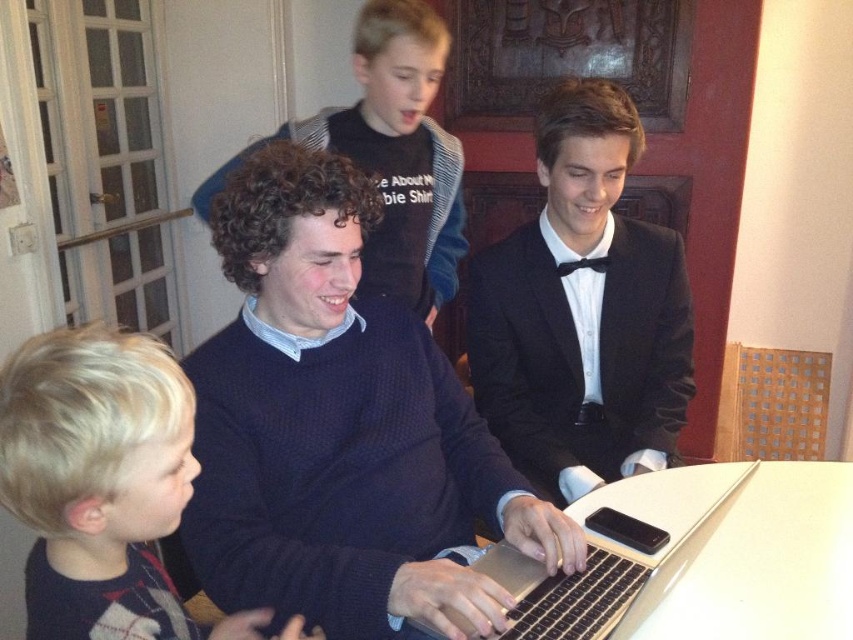
Between black satin tuxedo at center and silver metallic laptop at center, which one appears on the left side from the viewer's perspective?

silver metallic laptop at center is more to the left.

Who is taller, black satin tuxedo at center or silver metallic laptop at center?

With more height is black satin tuxedo at center.

Find the location of `black satin tuxedo at center`. black satin tuxedo at center is located at coordinates (582, 310).

Does black satin tuxedo at center have a lesser height compared to blonde hair at lower left?

Incorrect, black satin tuxedo at center's height does not fall short of blonde hair at lower left's.

Who is shorter, black satin tuxedo at center or blonde hair at lower left?

With less height is blonde hair at lower left.

Does point (653, 225) come farther from viewer compared to point (161, 582)?

Yes, it is behind point (161, 582).

Locate an element on the screen. black satin tuxedo at center is located at coordinates (582, 310).

Who is taller, dark blue sweater at center or blonde hair at lower left?

Standing taller between the two is dark blue sweater at center.

Can you confirm if dark blue sweater at center is positioned above blonde hair at lower left?

Indeed, dark blue sweater at center is positioned over blonde hair at lower left.

At what (x,y) coordinates should I click in order to perform the action: click on dark blue sweater at center. Please return your answer as a coordinate pair (x, y). Looking at the image, I should click on point(339,428).